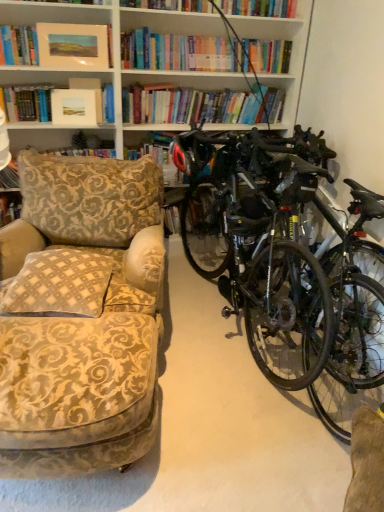
Question: Is shiny black bicycle at right bigger or smaller than matte black helmet at center?

Choices:
 (A) big
 (B) small

Answer: (A)

Question: Is shiny black bicycle at right taller or shorter than matte black helmet at center?

Choices:
 (A) tall
 (B) short

Answer: (A)

Question: Which object is the closest to the matte oil painting at upper left, positioned as the 2th book in bottom-to-top order?

Choices:
 (A) matte white picture frame at upper center
 (B) patterned fabric cushion at left, the 2th book when ordered from front to back
 (C) beige checkered pillow at left
 (D) shiny black bicycle at right
 (E) matte black helmet at center

Answer: (A)

Question: Which is farther from the matte black helmet at center?

Choices:
 (A) patterned fabric cushion at left, the 2th book from the top
 (B) shiny black bicycle at right
 (C) matte white picture frame at upper center
 (D) beige checkered pillow at left
 (E) matte oil painting at upper left, positioned as the 2th book in bottom-to-top order

Answer: (D)